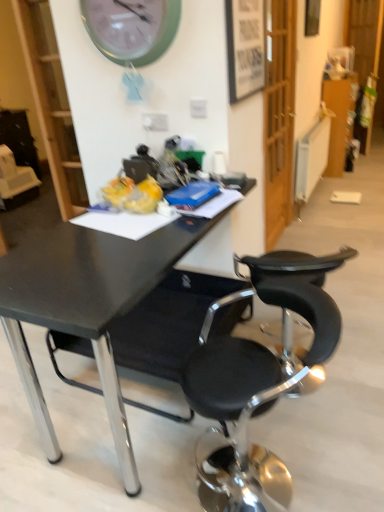
Question: In terms of size, does black matte desk at center appear bigger or smaller than wooden picture frame at upper right, arranged as the 2th picture frame when viewed from the front?

Choices:
 (A) big
 (B) small

Answer: (A)

Question: Considering the positions of black matte desk at center and wooden picture frame at upper right, the 1th picture frame positioned from the top, in the image, is black matte desk at center taller or shorter than wooden picture frame at upper right, the 1th picture frame positioned from the top,?

Choices:
 (A) tall
 (B) short

Answer: (A)

Question: Considering the real-world distances, which object is farthest from the black matte desk at center?

Choices:
 (A) black leather stool at lower right
 (B) wooden picture frame at upper right, marked as the 2th picture frame in a left-to-right arrangement
 (C) wooden framed poster at upper center, which is counted as the 2th picture frame, starting from the back
 (D) green plastic wall clock at upper center
 (E) white glossy bookshelf at upper left

Answer: (B)

Question: Based on their relative distances, which object is farther from the black matte desk at center?

Choices:
 (A) wooden picture frame at upper right, acting as the 1th picture frame starting from the right
 (B) white glossy bookshelf at upper left
 (C) black leather stool at lower right
 (D) green plastic wall clock at upper center
 (E) wooden framed poster at upper center, the second picture frame in the right-to-left sequence

Answer: (A)